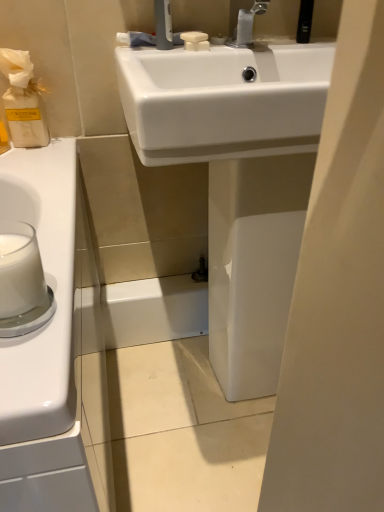
Question: Considering the relative sizes of silver metallic faucet at upper center and white opaque glass at left in the image provided, is silver metallic faucet at upper center taller than white opaque glass at left?

Choices:
 (A) yes
 (B) no

Answer: (A)

Question: From the image's perspective, is silver metallic faucet at upper center below white opaque glass at left?

Choices:
 (A) yes
 (B) no

Answer: (B)

Question: Considering the relative sizes of silver metallic faucet at upper center and white opaque glass at left in the image provided, is silver metallic faucet at upper center wider than white opaque glass at left?

Choices:
 (A) yes
 (B) no

Answer: (A)

Question: From a real-world perspective, is silver metallic faucet at upper center on white opaque glass at left?

Choices:
 (A) yes
 (B) no

Answer: (A)

Question: Would you say silver metallic faucet at upper center contains white opaque glass at left?

Choices:
 (A) no
 (B) yes

Answer: (A)

Question: From the image's perspective, is silver metallic faucet at upper center on white opaque glass at left?

Choices:
 (A) yes
 (B) no

Answer: (A)

Question: From the image's perspective, is white glossy sink at center below silver metallic faucet at upper center?

Choices:
 (A) yes
 (B) no

Answer: (A)

Question: From a real-world perspective, is white glossy sink at center physically above silver metallic faucet at upper center?

Choices:
 (A) no
 (B) yes

Answer: (A)

Question: Does white glossy sink at center have a greater height compared to silver metallic faucet at upper center?

Choices:
 (A) yes
 (B) no

Answer: (A)

Question: Can you confirm if white glossy sink at center is shorter than silver metallic faucet at upper center?

Choices:
 (A) no
 (B) yes

Answer: (A)

Question: Could you tell me if white glossy sink at center is turned towards silver metallic faucet at upper center?

Choices:
 (A) no
 (B) yes

Answer: (A)

Question: Does white glossy sink at center have a lesser width compared to silver metallic faucet at upper center?

Choices:
 (A) yes
 (B) no

Answer: (B)

Question: Does silver metallic faucet at upper center have a larger size compared to white glossy sink at center?

Choices:
 (A) no
 (B) yes

Answer: (A)